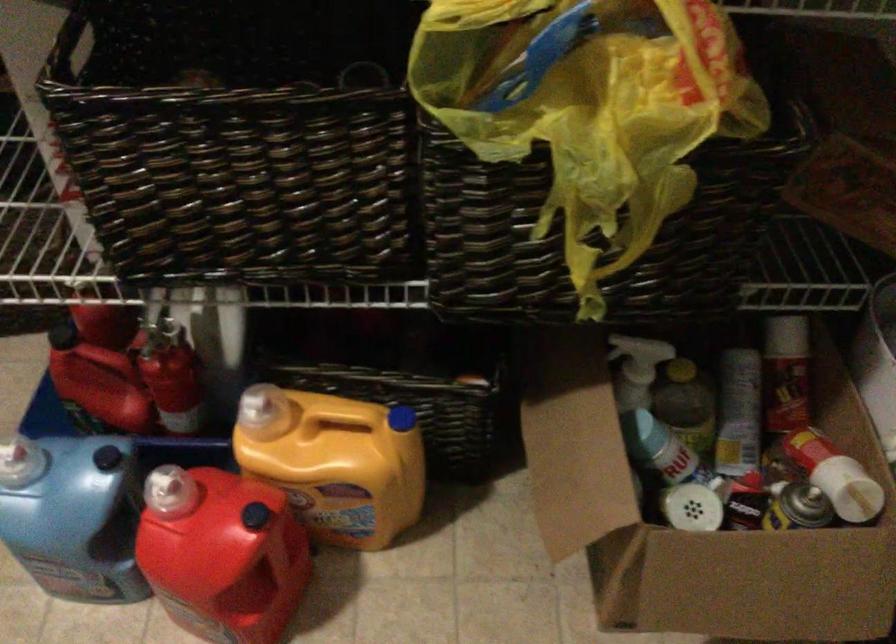
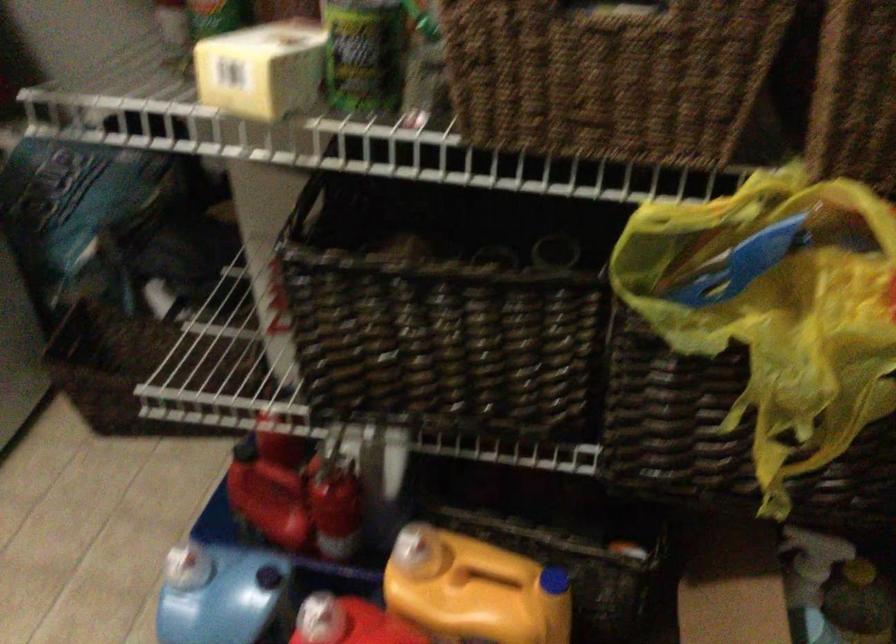
Where in the second image is the point corresponding to point (257, 410) from the first image?

(409, 550)